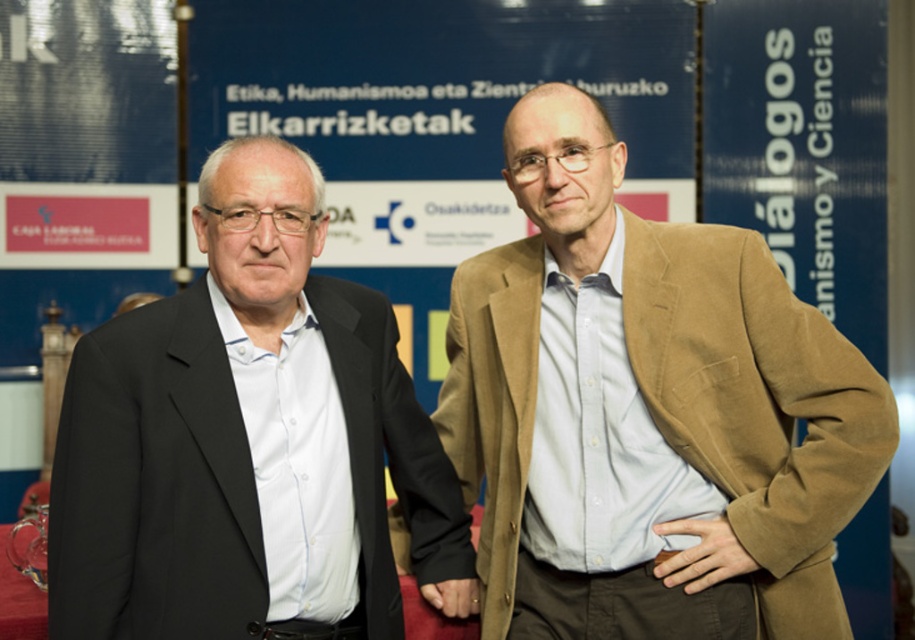
Is matte black suit at left positioned before light brown leather hand at center?

Yes, matte black suit at left is closer to the viewer.

Where is `matte black suit at left`? matte black suit at left is located at coordinates (245, 440).

Where is `matte black suit at left`? The width and height of the screenshot is (915, 640). matte black suit at left is located at coordinates click(245, 440).

Does light brown suede blazer at center have a larger size compared to smooth skin hand at center?

Indeed, light brown suede blazer at center has a larger size compared to smooth skin hand at center.

Does light brown suede blazer at center come in front of smooth skin hand at center?

Yes, it is in front of smooth skin hand at center.

This screenshot has width=915, height=640. What do you see at coordinates (644, 408) in the screenshot?
I see `light brown suede blazer at center` at bounding box center [644, 408].

This screenshot has width=915, height=640. Identify the location of light brown suede blazer at center. (644, 408).

Between light brown suede blazer at center and light brown leather hand at center, which one has more height?

light brown suede blazer at center

This screenshot has width=915, height=640. In order to click on light brown suede blazer at center in this screenshot , I will do `click(644, 408)`.

Where is `light brown suede blazer at center`? The width and height of the screenshot is (915, 640). light brown suede blazer at center is located at coordinates (644, 408).